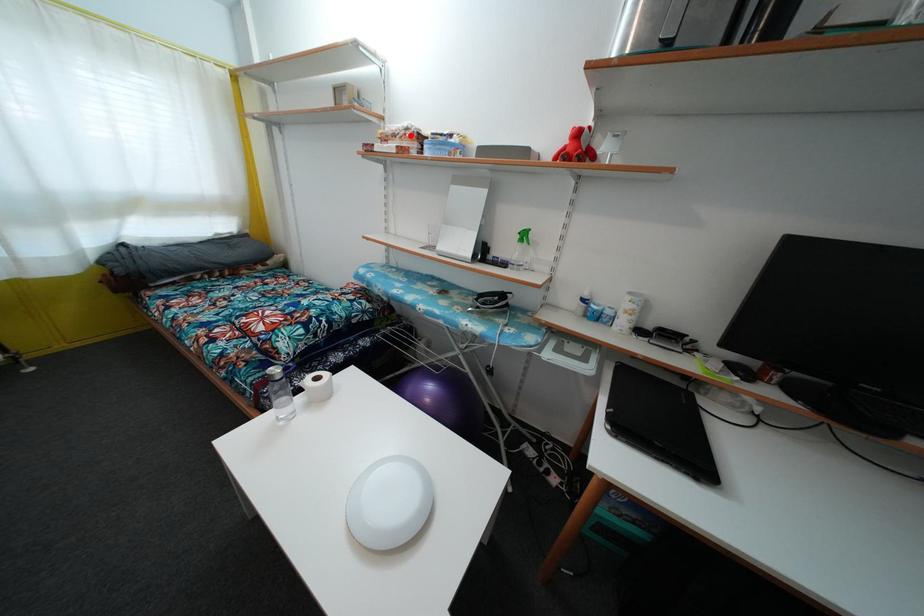
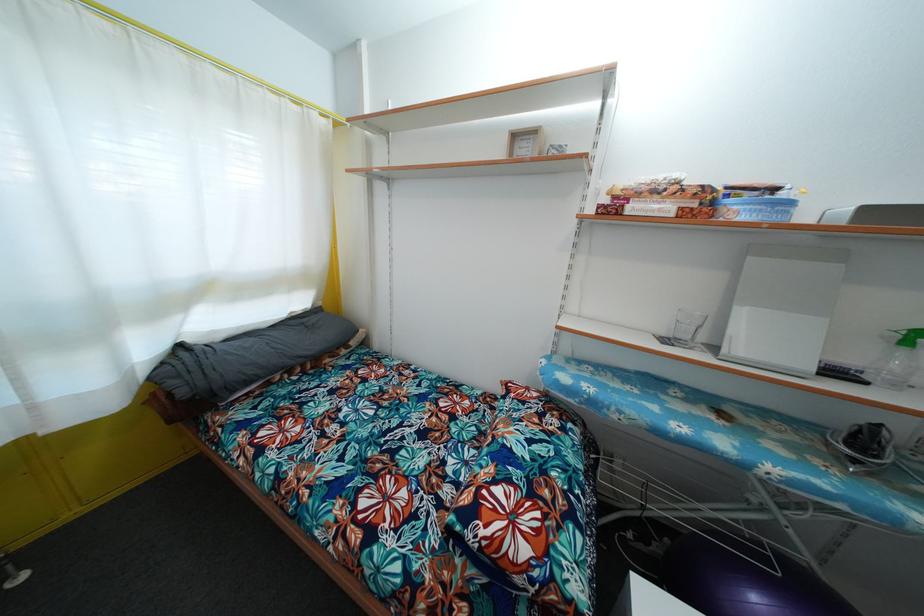
The point at the highlighted location is marked in the first image. Where is the corresponding point in the second image?

(683, 188)